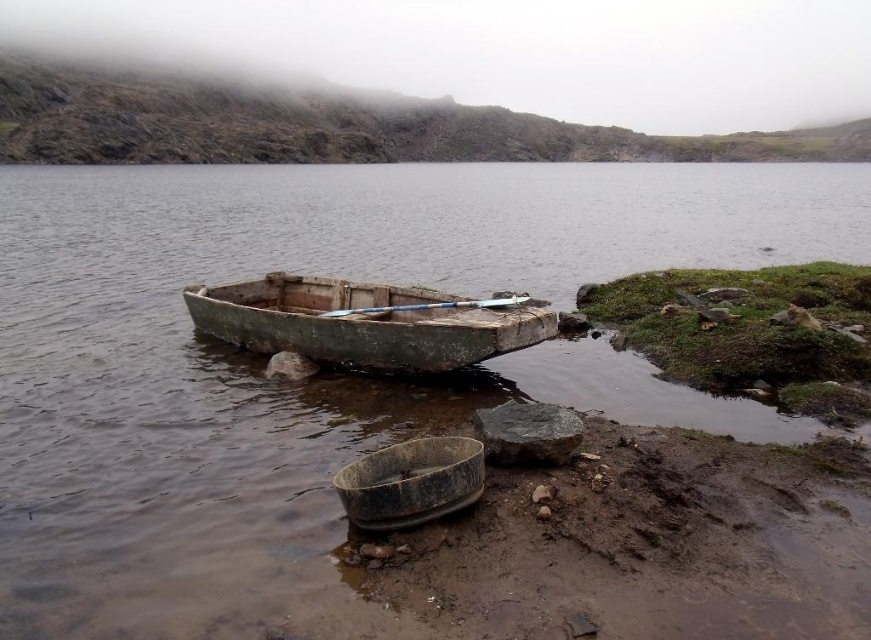
In the scene shown: How far apart are muddy wet soil at lower right and rusty metal boat at center?

muddy wet soil at lower right is 6.44 meters from rusty metal boat at center.

Is muddy wet soil at lower right further to the viewer compared to rusty metal boat at center?

No.

Between point (798, 520) and point (284, 305), which one is positioned in front?

Point (798, 520) is more forward.

Find the location of a particular element. muddy wet soil at lower right is located at coordinates (640, 547).

Between point (763, 260) and point (728, 500), which one is positioned in front?

Point (728, 500)

This screenshot has width=871, height=640. I want to click on brown matte water at center, so click(x=321, y=376).

What do you see at coordinates (321, 376) in the screenshot? The height and width of the screenshot is (640, 871). I see `brown matte water at center` at bounding box center [321, 376].

Where is `brown matte water at center`? The width and height of the screenshot is (871, 640). brown matte water at center is located at coordinates (321, 376).

Measure the distance from brown matte water at center to rusty metal basin at lower center.

A distance of 54.80 feet exists between brown matte water at center and rusty metal basin at lower center.

Is brown matte water at center smaller than rusty metal basin at lower center?

No.

Find the location of `brown matte water at center`. brown matte water at center is located at coordinates (321, 376).

In order to click on brown matte water at center in this screenshot , I will do `click(321, 376)`.